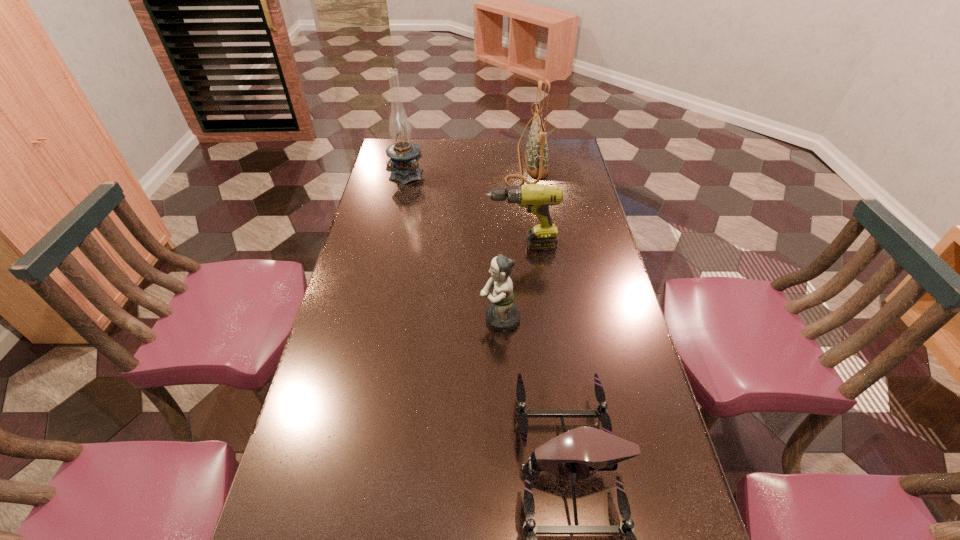
The height and width of the screenshot is (540, 960). I want to click on object that is at the far left corner, so click(404, 154).

Identify the location of object that is positioned at the far right corner. The width and height of the screenshot is (960, 540). (536, 154).

Where is `vacant area at the far edge`? The height and width of the screenshot is (540, 960). vacant area at the far edge is located at coordinates (466, 163).

Locate an element on the screen. vacant area at the left edge is located at coordinates (376, 217).

The width and height of the screenshot is (960, 540). I want to click on free space at the right edge of the desktop, so click(572, 176).

Locate an element on the screen. The image size is (960, 540). vacant position at the far right corner of the desktop is located at coordinates (557, 151).

Image resolution: width=960 pixels, height=540 pixels. What are the coordinates of `free space between the handbag and the oil lamp` in the screenshot? It's located at (467, 168).

You are a GUI agent. You are given a task and a screenshot of the screen. Output one action in this format:
    pyautogui.click(x=<x>, y=<y>)
    Task: Click on the vacant area between the fourth farthest object and the leftmost object
    
    Given the screenshot: What is the action you would take?
    pyautogui.click(x=453, y=246)

I want to click on empty location between the figurine and the oil lamp, so click(x=453, y=246).

At what (x,y) coordinates should I click in order to perform the action: click on vacant area between the figurine and the handbag. Please return your answer as a coordinate pair (x, y). This screenshot has height=540, width=960. Looking at the image, I should click on (513, 241).